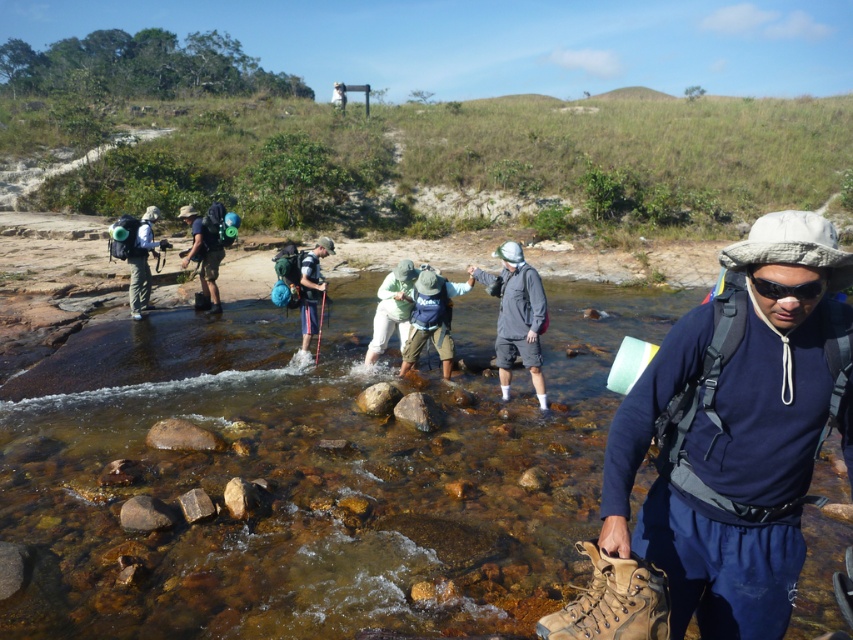
Does matte green backpack at left have a greater width compared to black matte sunglasses at center?

Yes, matte green backpack at left is wider than black matte sunglasses at center.

Between matte green backpack at left and black matte sunglasses at center, which one is positioned lower?

black matte sunglasses at center is below.

This screenshot has height=640, width=853. What do you see at coordinates (136, 253) in the screenshot?
I see `matte green backpack at left` at bounding box center [136, 253].

At what (x,y) coordinates should I click in order to perform the action: click on matte green backpack at left. Please return your answer as a coordinate pair (x, y). This screenshot has height=640, width=853. Looking at the image, I should click on (136, 253).

Can you confirm if matte blue backpack at center is shorter than black matte sunglasses at center?

No.

Which of these two, matte blue backpack at center or black matte sunglasses at center, stands shorter?

black matte sunglasses at center

You are a GUI agent. You are given a task and a screenshot of the screen. Output one action in this format:
    pyautogui.click(x=<x>, y=<y>)
    Task: Click on the matte blue backpack at center
    
    Given the screenshot: What is the action you would take?
    pyautogui.click(x=431, y=320)

Image resolution: width=853 pixels, height=640 pixels. In order to click on clear water at center in this screenshot , I will do `click(308, 476)`.

Can you confirm if clear water at center is smaller than matte green backpack at center?

Incorrect, clear water at center is not smaller in size than matte green backpack at center.

Is point (335, 344) positioned after point (219, 221)?

No, (335, 344) is closer to viewer.

Where is `clear water at center`? The height and width of the screenshot is (640, 853). clear water at center is located at coordinates (308, 476).